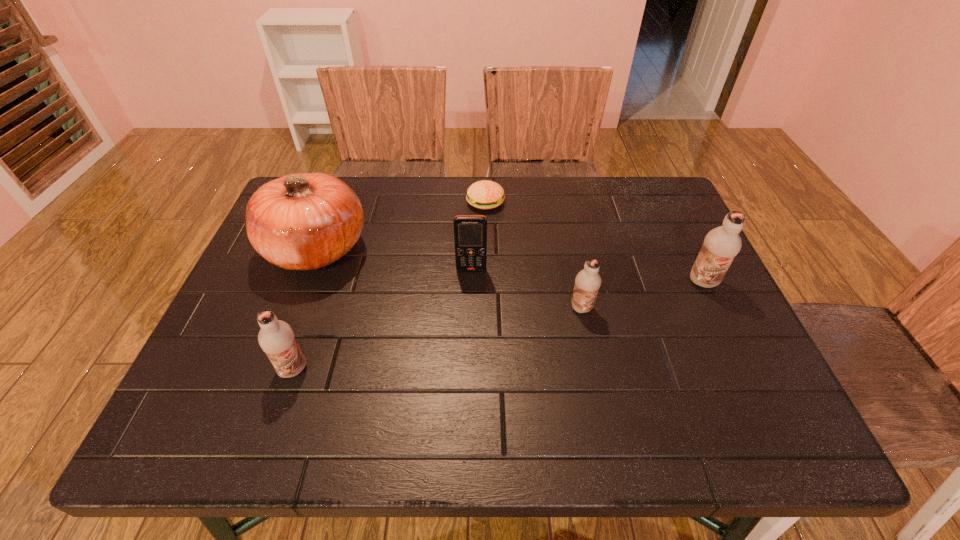
What are the coordinates of `the second closest chocolate milk to the cellular telephone` in the screenshot? It's located at (276, 338).

I want to click on vacant space that satisfies the following two spatial constraints: 1. on the back side of the rightmost object; 2. on the left side of the second tallest chocolate milk, so click(x=323, y=282).

The height and width of the screenshot is (540, 960). Identify the location of free space that satisfies the following two spatial constraints: 1. on the screen of the rightmost chocolate milk; 2. on the right side of the cellular telephone. (471, 282).